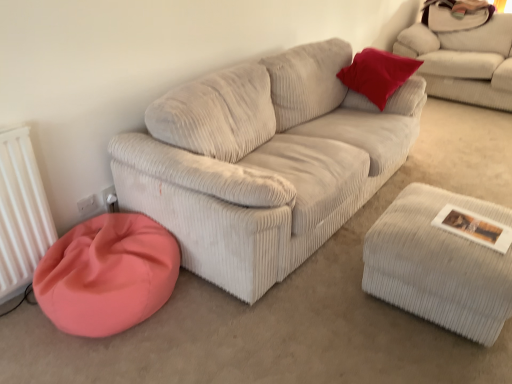
Question: Is white corduroy couch at upper right next to coral fabric bean bag at lower left?

Choices:
 (A) no
 (B) yes

Answer: (A)

Question: From the image's perspective, does white corduroy couch at upper right appear lower than coral fabric bean bag at lower left?

Choices:
 (A) yes
 (B) no

Answer: (B)

Question: Is white corduroy couch at upper right at the left side of coral fabric bean bag at lower left?

Choices:
 (A) yes
 (B) no

Answer: (B)

Question: Are white corduroy couch at upper right and coral fabric bean bag at lower left far apart?

Choices:
 (A) no
 (B) yes

Answer: (B)

Question: From the image's perspective, is white corduroy couch at upper right over coral fabric bean bag at lower left?

Choices:
 (A) yes
 (B) no

Answer: (A)

Question: Visually, is white corduroy couch at upper right positioned to the left or to the right of coral fabric bean bag at lower left?

Choices:
 (A) right
 (B) left

Answer: (A)

Question: From a real-world perspective, is white corduroy couch at upper right positioned above or below coral fabric bean bag at lower left?

Choices:
 (A) below
 (B) above

Answer: (B)

Question: Looking at the image, does white corduroy couch at upper right seem bigger or smaller compared to coral fabric bean bag at lower left?

Choices:
 (A) small
 (B) big

Answer: (B)

Question: In terms of width, does white corduroy couch at upper right look wider or thinner when compared to coral fabric bean bag at lower left?

Choices:
 (A) wide
 (B) thin

Answer: (A)

Question: In the image, is white corduroy couch at upper right positioned in front of or behind white corduroy stool at lower right?

Choices:
 (A) behind
 (B) front

Answer: (A)

Question: In terms of height, does white corduroy couch at upper right look taller or shorter compared to white corduroy stool at lower right?

Choices:
 (A) tall
 (B) short

Answer: (A)

Question: Considering the positions of white corduroy couch at upper right and white corduroy stool at lower right in the image, is white corduroy couch at upper right bigger or smaller than white corduroy stool at lower right?

Choices:
 (A) big
 (B) small

Answer: (A)

Question: From the image's perspective, is white corduroy couch at upper right above or below white corduroy stool at lower right?

Choices:
 (A) above
 (B) below

Answer: (A)

Question: Is point (419, 299) closer or farther from the camera than point (86, 238)?

Choices:
 (A) closer
 (B) farther

Answer: (A)

Question: Based on their positions, is white corduroy stool at lower right located to the left or right of coral fabric bean bag at lower left?

Choices:
 (A) right
 (B) left

Answer: (A)